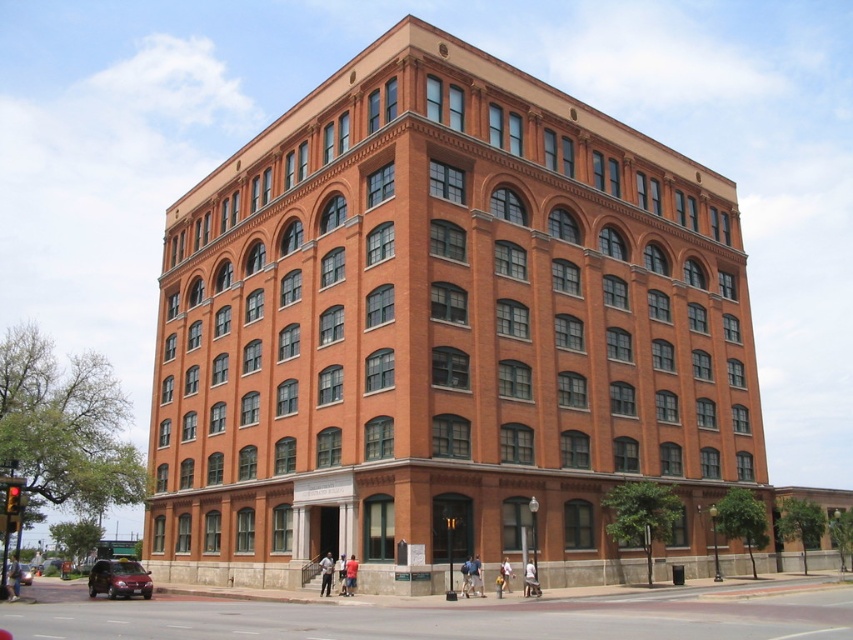
Between point (123, 564) and point (22, 572), which one is positioned in front?

Point (123, 564)

Does point (106, 582) come closer to viewer compared to point (28, 580)?

That is True.

At what (x,y) coordinates should I click in order to perform the action: click on metallic red sedan at lower left. Please return your answer as a coordinate pair (x, y). The width and height of the screenshot is (853, 640). Looking at the image, I should click on (119, 579).